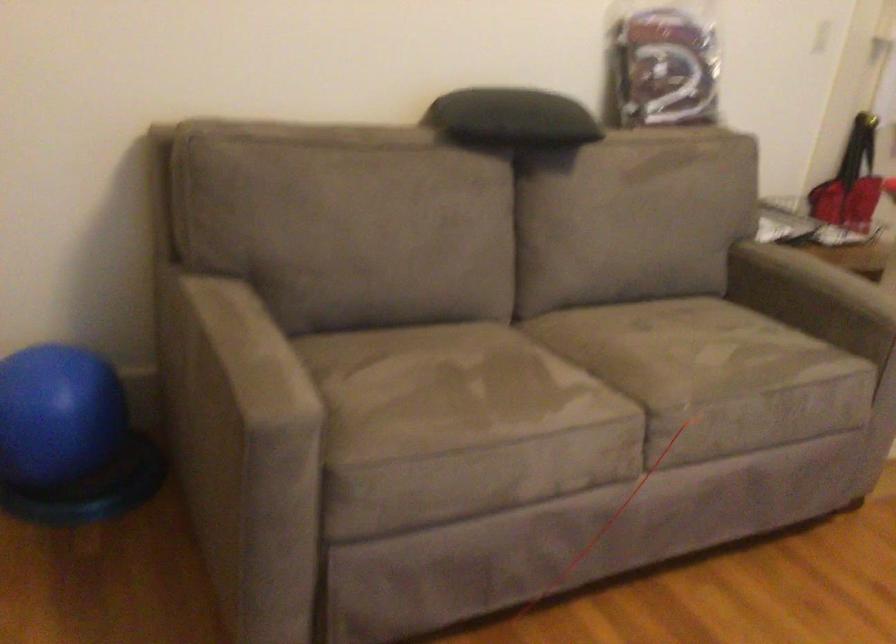
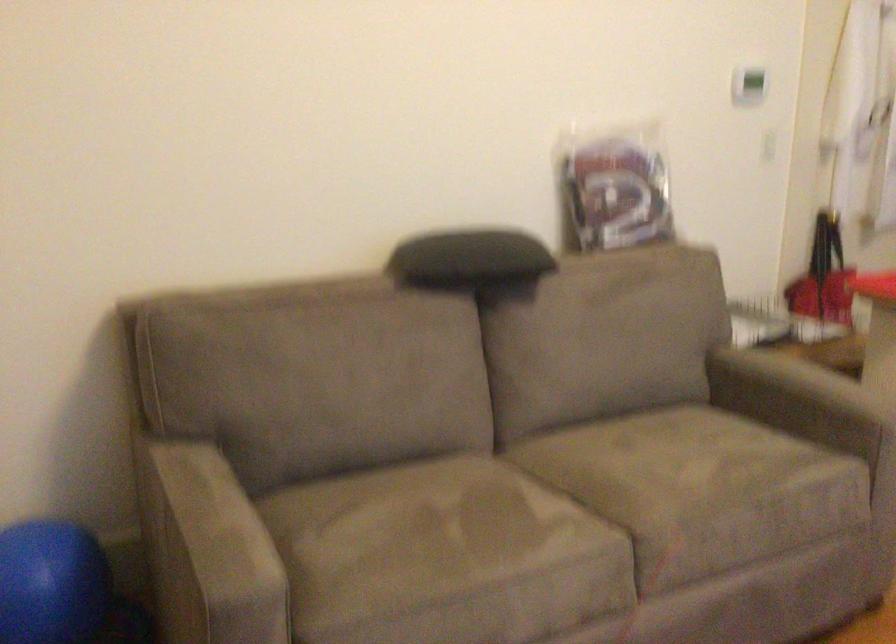
Question: Based on the continuous images, in which direction is the camera rotating? Reply with the corresponding letter.

Choices:
 (A) Left
 (B) Right
 (C) Up
 (D) Down

Answer: (C)